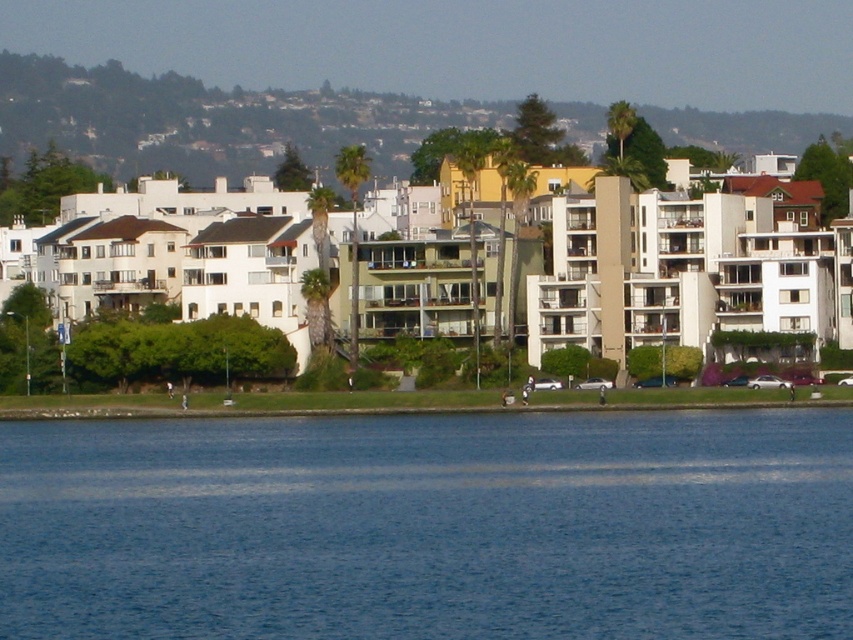
You are standing at the waterfront and want to take a photo that includes both the blue water at lower center and the green leafy hillside at upper center. Based on their positions, where should you position the camera to capture both elements in the frame?

To capture both the blue water at lower center and the green leafy hillside at upper center in the frame, position the camera to the right of the blue water at lower center since it is to the left of the green leafy hillside at upper center.

You are a landscape architect evaluating the waterfront area. You need to determine which area is larger in size between the blue water at lower center and the green leafy hillside at upper center. Which one is larger?

The green leafy hillside at upper center is larger than the blue water at lower center according to the description.

You are planning to build a small boat dock. The blue water at lower center is narrower than the green leafy hillside at upper center. Based on the scene description, which area would be more suitable for the dock and why?

The blue water at lower center is more suitable for building the dock because it is narrower, making it easier to construct and manage the dock within the confined space. The green leafy hillside at upper center is wider and likely part of the land, not suitable for water activities.